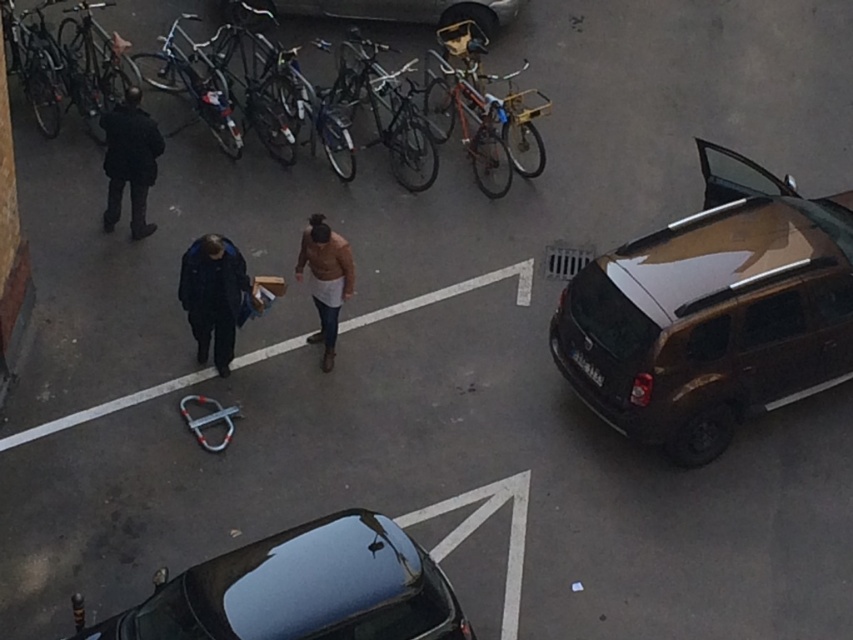
Question: Which object is farther from the camera taking this photo?

Choices:
 (A) shiny black car at lower left
 (B) dark wool coat at left
 (C) metallic silver van at upper center
 (D) dark blue jacket at center

Answer: (C)

Question: Considering the real-world distances, which object is farthest from the shiny brown minivan at right?

Choices:
 (A) dark blue jacket at center
 (B) light brown leather jacket at center
 (C) dark wool coat at left

Answer: (C)

Question: Does dark blue jacket at center have a larger size compared to dark wool coat at left?

Choices:
 (A) yes
 (B) no

Answer: (B)

Question: Estimate the real-world distances between objects in this image. Which object is closer to the metallic silver van at upper center?

Choices:
 (A) dark wool coat at left
 (B) shiny brown minivan at right
 (C) dark blue jacket at center
 (D) shiny black car at lower left

Answer: (A)

Question: Does shiny black car at lower left have a smaller size compared to dark wool coat at left?

Choices:
 (A) no
 (B) yes

Answer: (A)

Question: Can you confirm if shiny brown minivan at right is bigger than shiny silver bicycle at upper left?

Choices:
 (A) no
 (B) yes

Answer: (B)